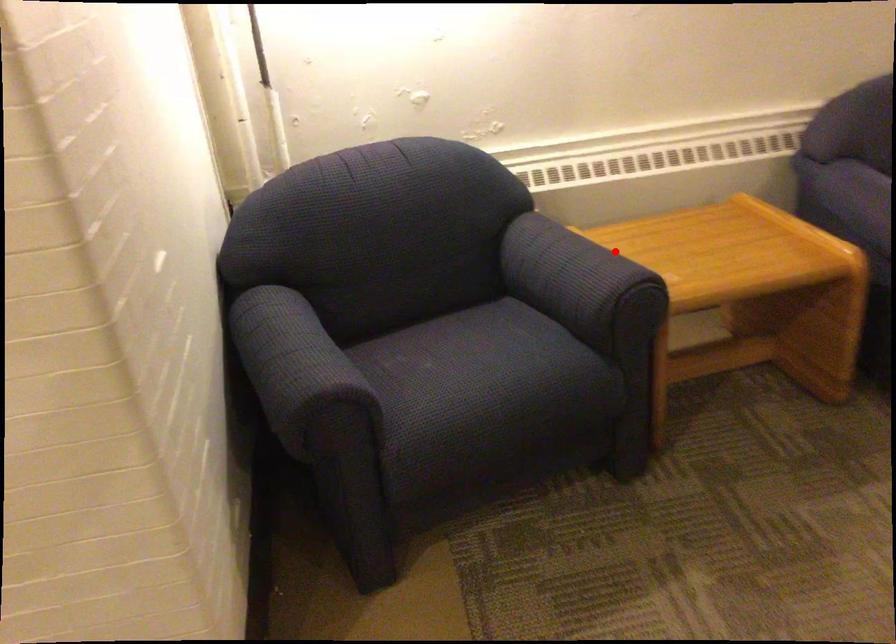
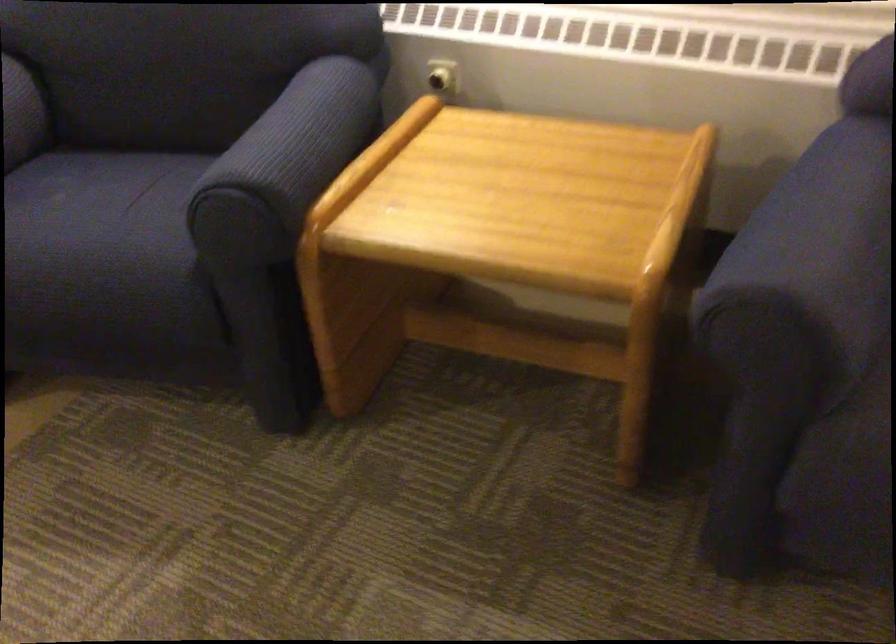
Question: I am providing you with two images of the same scene from different viewpoints. A red point is shown in image1. For the corresponding object point in image2, is it positioned nearer or farther from the camera?

Choices:
 (A) Nearer
 (B) Farther

Answer: (A)